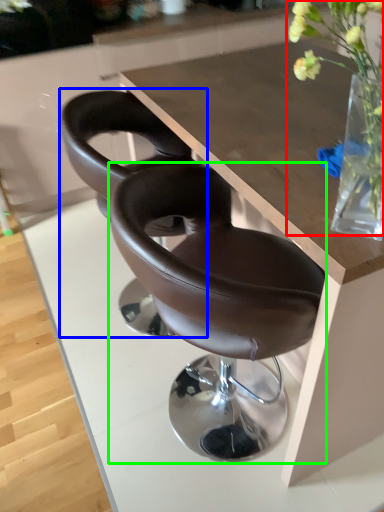
Question: Based on their relative distances, which object is farther from floral arrangement (highlighted by a red box)? Choose from chair (highlighted by a blue box) and chair (highlighted by a green box).

Choices:
 (A) chair
 (B) chair

Answer: (A)